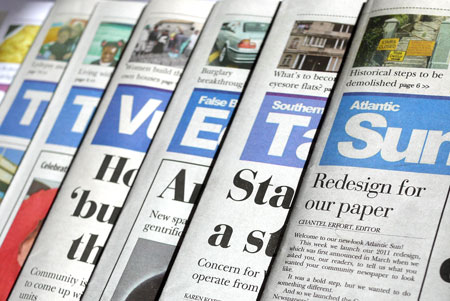
The width and height of the screenshot is (450, 301). What are the coordinates of `newspapers` in the screenshot? It's located at (413, 137), (290, 127), (214, 126), (141, 104), (71, 121), (33, 108), (12, 45).